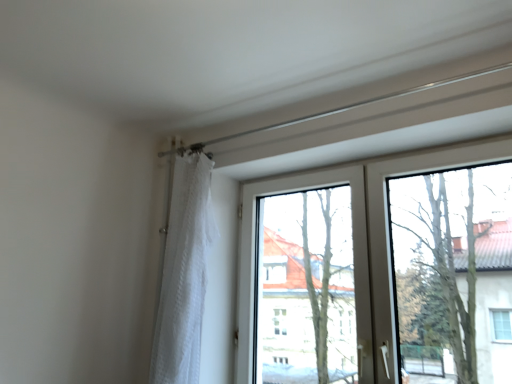
Question: Is transparent glass tree at upper right at the right side of white sheer curtain at left?

Choices:
 (A) no
 (B) yes

Answer: (B)

Question: Is transparent glass tree at upper right placed right next to white sheer curtain at left?

Choices:
 (A) yes
 (B) no

Answer: (B)

Question: Could you tell me if transparent glass tree at upper right is turned towards white sheer curtain at left?

Choices:
 (A) yes
 (B) no

Answer: (B)

Question: Can you confirm if transparent glass tree at upper right is shorter than white sheer curtain at left?

Choices:
 (A) yes
 (B) no

Answer: (A)

Question: Is transparent glass tree at upper right positioned with its back to white sheer curtain at left?

Choices:
 (A) no
 (B) yes

Answer: (A)

Question: Considering the relative sizes of transparent glass tree at upper right and white sheer curtain at left in the image provided, is transparent glass tree at upper right bigger than white sheer curtain at left?

Choices:
 (A) yes
 (B) no

Answer: (B)

Question: Can you confirm if transparent glass tree at upper right is smaller than transparent glass window at center?

Choices:
 (A) yes
 (B) no

Answer: (A)

Question: Can you confirm if transparent glass tree at upper right is wider than transparent glass window at center?

Choices:
 (A) no
 (B) yes

Answer: (A)

Question: Would you say transparent glass window at center is part of transparent glass tree at upper right's contents?

Choices:
 (A) yes
 (B) no

Answer: (B)

Question: Is transparent glass tree at upper right behind transparent glass window at center?

Choices:
 (A) no
 (B) yes

Answer: (A)

Question: From a real-world perspective, is transparent glass tree at upper right positioned under transparent glass window at center based on gravity?

Choices:
 (A) yes
 (B) no

Answer: (B)

Question: From a real-world perspective, is transparent glass tree at upper right positioned over transparent glass window at center based on gravity?

Choices:
 (A) yes
 (B) no

Answer: (A)

Question: From a real-world perspective, is white sheer curtain at left physically below transparent glass tree at upper right?

Choices:
 (A) no
 (B) yes

Answer: (B)